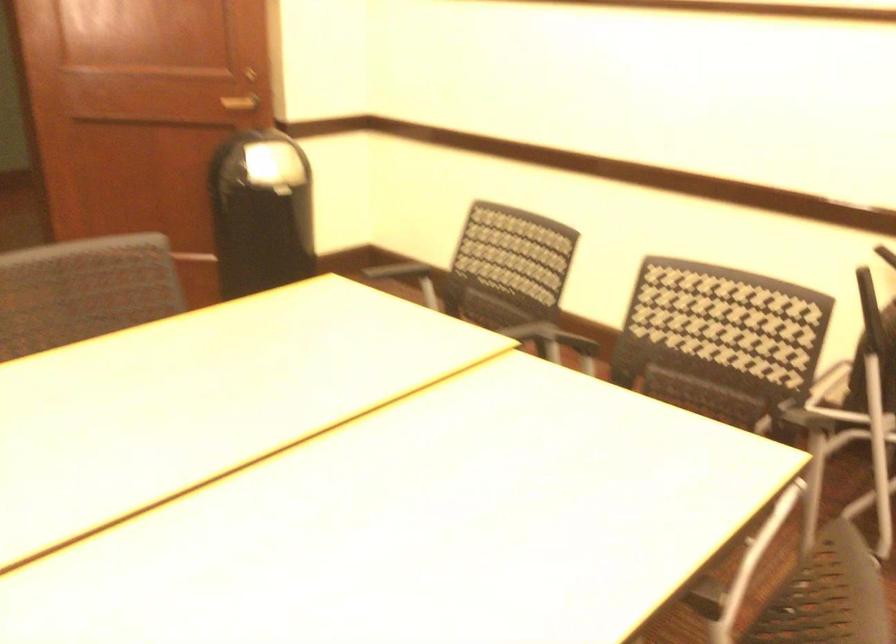
Find the location of a particular element. trash can lid is located at coordinates (274, 166).